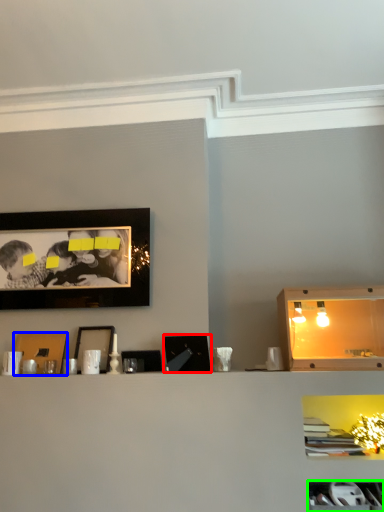
Question: Based on their relative distances, which object is nearer to picture frame (highlighted by a red box)? Choose from picture frame (highlighted by a blue box) and cabinet (highlighted by a green box).

Choices:
 (A) picture frame
 (B) cabinet

Answer: (A)